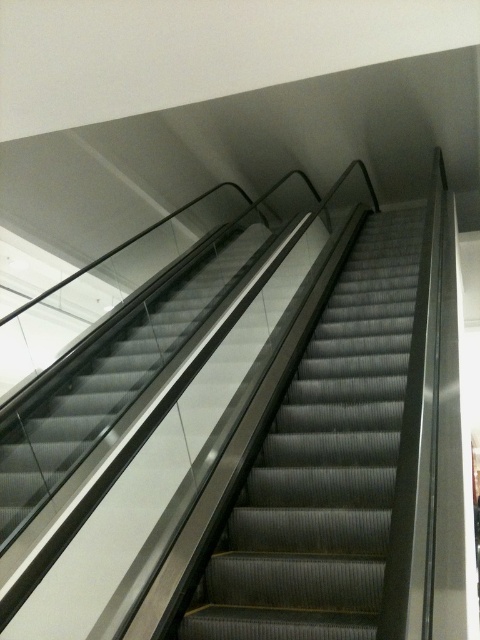
Is point (332, 380) farther from camera compared to point (57, 476)?

Yes, it is behind point (57, 476).

Is metallic gray escalator at center bigger than metallic gray escalator at left?

No, metallic gray escalator at center is not bigger than metallic gray escalator at left.

Measure the distance between metallic gray escalator at center and camera.

1.79 meters

Where is `metallic gray escalator at center`? This screenshot has width=480, height=640. metallic gray escalator at center is located at coordinates (324, 465).